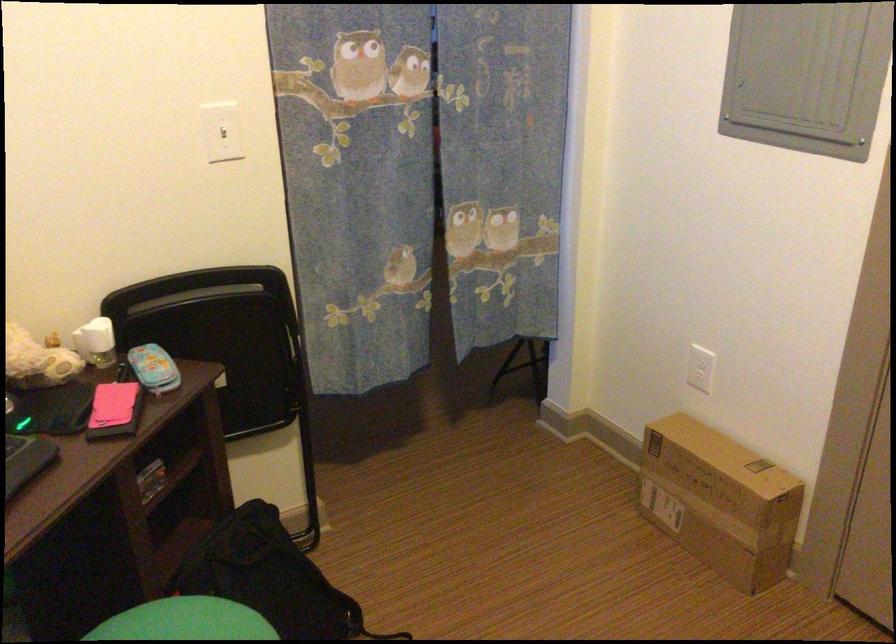
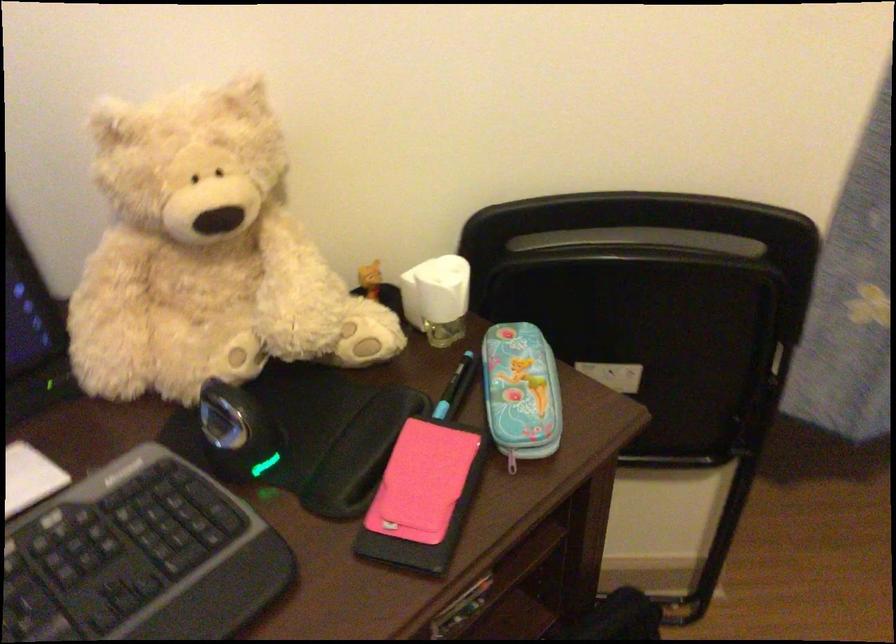
Find the pixel in the second image that matches point 156,393 in the first image.

(512, 460)